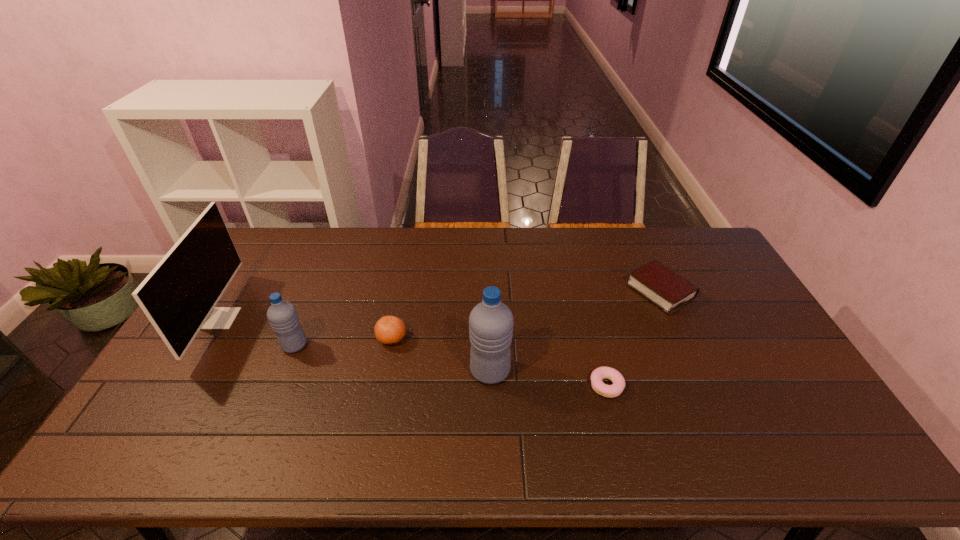
I want to click on vacant space that satisfies the following two spatial constraints: 1. on the front-facing side of the monitor; 2. on the back side of the third tallest object, so coord(204,345).

This screenshot has height=540, width=960. What are the coordinates of `vacant area in the image that satisfies the following two spatial constraints: 1. on the front-facing side of the monitor; 2. on the back side of the right water bottle` in the screenshot? It's located at (188, 371).

At what (x,y) coordinates should I click in order to perform the action: click on vacant space that satisfies the following two spatial constraints: 1. on the back side of the fifth object from left to right; 2. on the front-facing side of the monitor. Please return your answer as a coordinate pair (x, y). The width and height of the screenshot is (960, 540). Looking at the image, I should click on [589, 318].